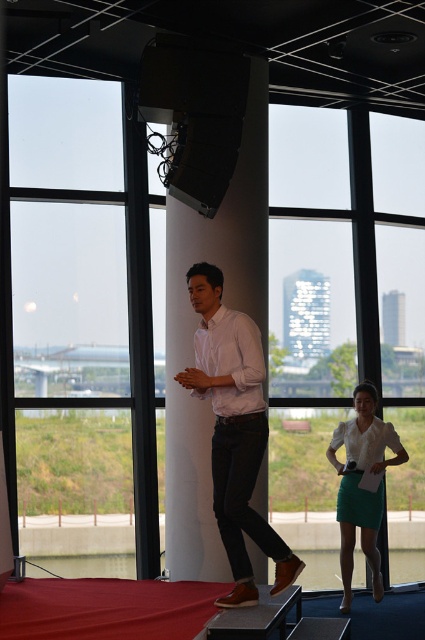
Question: Which object appears closest to the camera in this image?

Choices:
 (A) white shirt at center
 (B) white glossy pillar at center

Answer: (A)

Question: Which point is farther from the camera taking this photo?

Choices:
 (A) (385, 444)
 (B) (272, 552)

Answer: (A)

Question: Does white glossy pillar at center lie in front of white shirt at center?

Choices:
 (A) yes
 (B) no

Answer: (B)

Question: Is white glossy pillar at center wider than white shirt at center?

Choices:
 (A) no
 (B) yes

Answer: (B)

Question: Considering the relative positions of white shirt at center and matte white blouse at center in the image provided, where is white shirt at center located with respect to matte white blouse at center?

Choices:
 (A) above
 (B) below

Answer: (A)

Question: Which point is farther to the camera?

Choices:
 (A) (337, 433)
 (B) (215, 486)

Answer: (A)